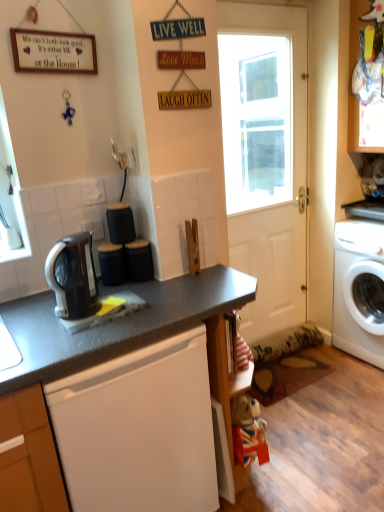
Identify the location of free area in between black glossy coffee maker at left and black fabric ottoman at center, the 2th appliance from the left. Image resolution: width=384 pixels, height=512 pixels. (127, 291).